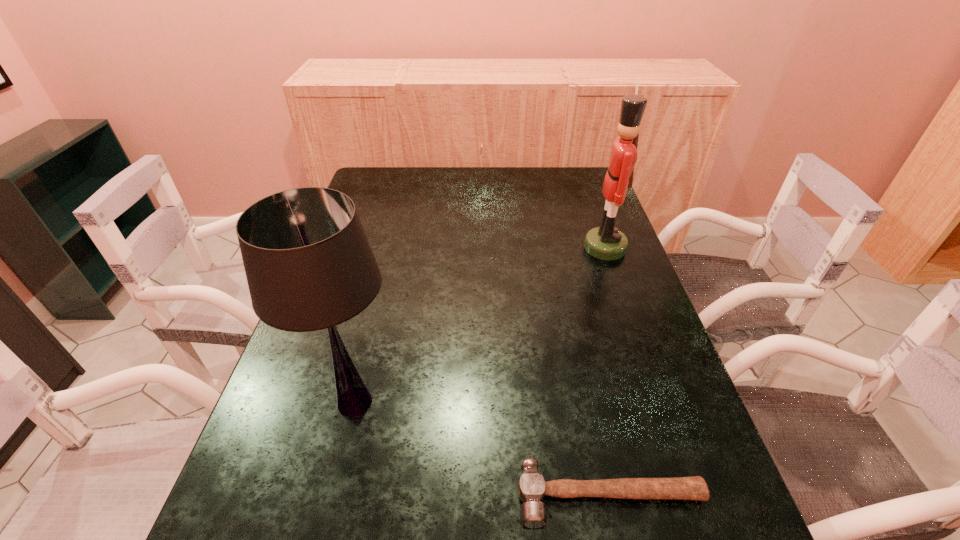
Image resolution: width=960 pixels, height=540 pixels. I want to click on nutcracker, so click(x=606, y=242).

Where is `the leftmost object`? The image size is (960, 540). the leftmost object is located at coordinates (309, 266).

This screenshot has width=960, height=540. I want to click on the second farthest object, so [309, 266].

Where is `hammer`? hammer is located at coordinates (532, 488).

You are a GUI agent. You are given a task and a screenshot of the screen. Output one action in this format:
    pyautogui.click(x=<x>, y=<y>)
    Task: Click on the nearest object
    
    Given the screenshot: What is the action you would take?
    pyautogui.click(x=532, y=488)

You are a GUI agent. You are given a task and a screenshot of the screen. Output one action in this format:
    pyautogui.click(x=<x>, y=<y>)
    Task: Click on the vacant area situated 0.200m on the front-facing side of the nutcracker
    
    Given the screenshot: What is the action you would take?
    pyautogui.click(x=516, y=248)

Locate an element on the screen. This screenshot has height=540, width=960. vacant space located 0.350m on the front-facing side of the nutcracker is located at coordinates (465, 248).

Identify the location of free spot located on the front-facing side of the nutcracker. (482, 248).

Locate an element on the screen. vacant space situated 0.050m on the front-facing side of the lampshade is located at coordinates (337, 474).

At what (x,y) coordinates should I click in order to perform the action: click on object present at the left edge. Please return your answer as a coordinate pair (x, y). This screenshot has height=540, width=960. Looking at the image, I should click on (309, 266).